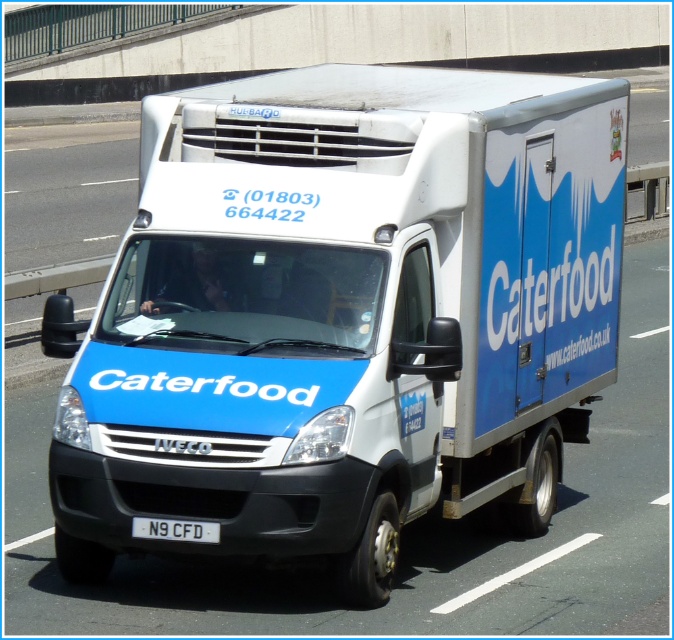
Question: Among these points, which one is nearest to the camera?

Choices:
 (A) (590, 339)
 (B) (133, 536)

Answer: (B)

Question: Among these objects, which one is nearest to the camera?

Choices:
 (A) white plastic license plate at center
 (B) blue matte truck at center

Answer: (B)

Question: Observing the image, what is the correct spatial positioning of blue matte truck at center in reference to white plastic license plate at center?

Choices:
 (A) left
 (B) right

Answer: (B)

Question: Is blue matte truck at center to the left of white plastic license plate at center from the viewer's perspective?

Choices:
 (A) no
 (B) yes

Answer: (A)

Question: Does blue matte truck at center appear on the right side of white plastic license plate at center?

Choices:
 (A) no
 (B) yes

Answer: (B)

Question: Which object appears farthest from the camera in this image?

Choices:
 (A) blue matte truck at center
 (B) white plastic license plate at center

Answer: (B)